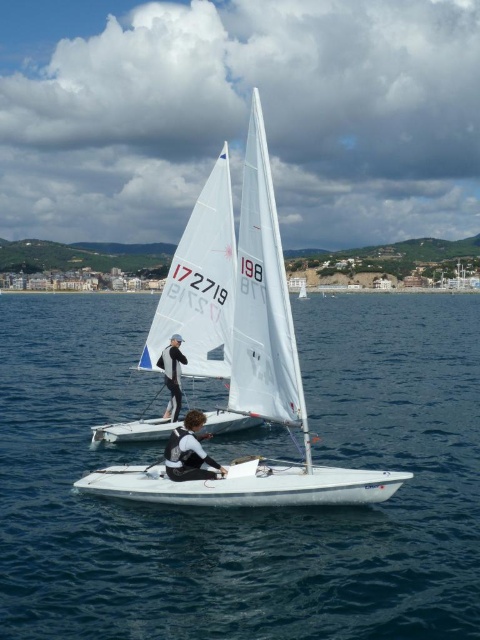
Does black neoprene wetsuit at center have a greater width compared to white matte sailboat at center?

No, black neoprene wetsuit at center is not wider than white matte sailboat at center.

Who is higher up, black neoprene wetsuit at center or white matte sailboat at center?

Positioned higher is white matte sailboat at center.

Is point (192, 476) positioned after point (300, 284)?

No.

Identify the location of black neoprene wetsuit at center. (189, 451).

Which is more to the right, white smooth water at center or white glossy sailboat at center?

Positioned to the right is white glossy sailboat at center.

Describe the element at coordinates (242, 508) in the screenshot. I see `white smooth water at center` at that location.

You are a GUI agent. You are given a task and a screenshot of the screen. Output one action in this format:
    pyautogui.click(x=<x>, y=<y>)
    Task: Click on the white smooth water at center
    
    Given the screenshot: What is the action you would take?
    click(x=242, y=508)

The height and width of the screenshot is (640, 480). What are the coordinates of `white smooth water at center` in the screenshot? It's located at (242, 508).

Who is more forward, (196,476) or (167,416)?

Point (196,476)

Is the position of black neoprene wetsuit at center more distant than that of black wetsuit at center?

No, it is in front of black wetsuit at center.

Locate an element on the screen. black neoprene wetsuit at center is located at coordinates (189, 451).

Where is `black neoprene wetsuit at center`? This screenshot has height=640, width=480. black neoprene wetsuit at center is located at coordinates (189, 451).